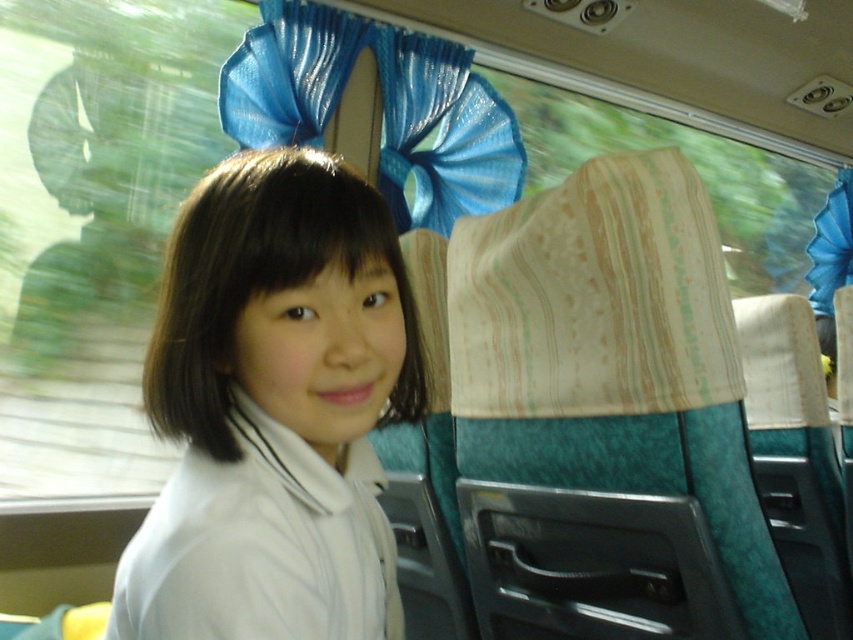
Question: Does white fabric at center have a greater width compared to shiny blue fabric at upper center?

Choices:
 (A) yes
 (B) no

Answer: (B)

Question: Can you confirm if white fabric at center is smaller than shiny blue fabric at upper center?

Choices:
 (A) no
 (B) yes

Answer: (B)

Question: Can you confirm if white fabric at center is bigger than shiny blue fabric at upper center?

Choices:
 (A) no
 (B) yes

Answer: (A)